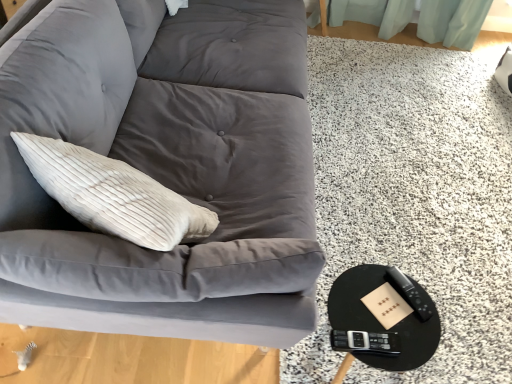
Question: Considering the positions of point (378, 281) and point (413, 299), is point (378, 281) closer or farther from the camera than point (413, 299)?

Choices:
 (A) farther
 (B) closer

Answer: (A)

Question: Relative to black plastic remote at lower right, is black glossy round table at lower right in front or behind?

Choices:
 (A) front
 (B) behind

Answer: (A)

Question: Which of these objects is positioned farthest from the matte gray fabric couch at upper left?

Choices:
 (A) black plastic remote at lower right
 (B) black glossy round table at lower right

Answer: (A)

Question: Based on their relative distances, which object is farther from the matte gray fabric couch at upper left?

Choices:
 (A) black glossy round table at lower right
 (B) black plastic remote at lower right

Answer: (B)